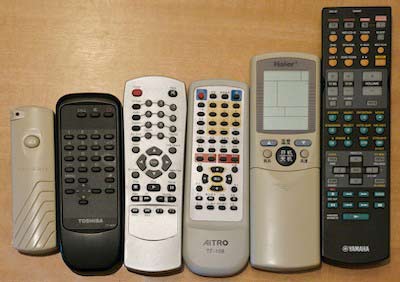
The image size is (400, 282). I want to click on screen, so click(x=281, y=120).